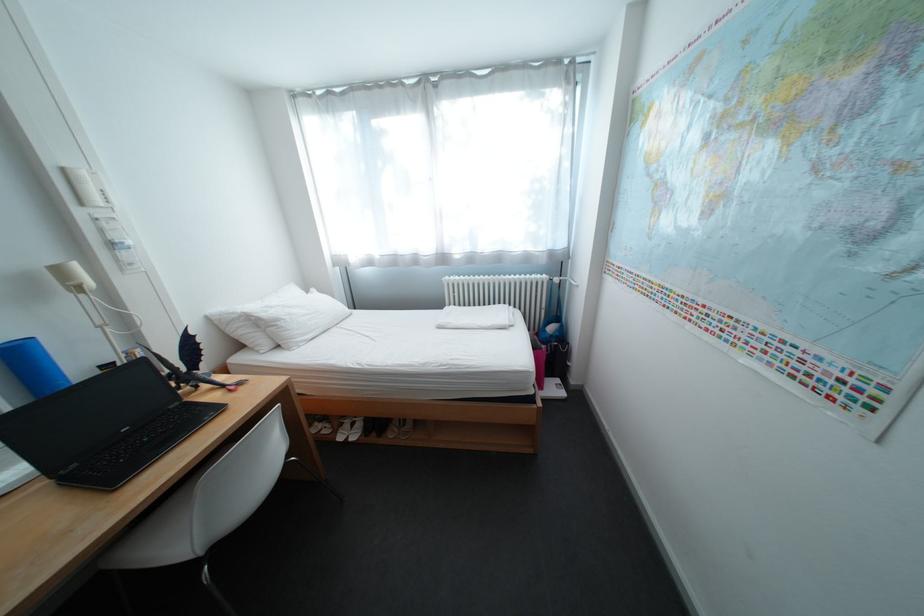
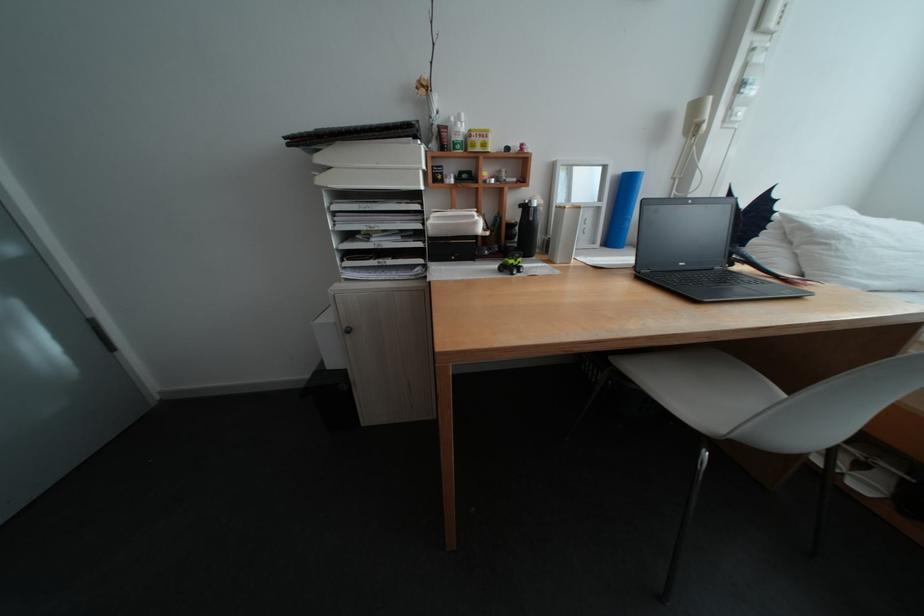
Where in the second image is the point corresponding to pixel 137 431 from the first image?

(694, 265)